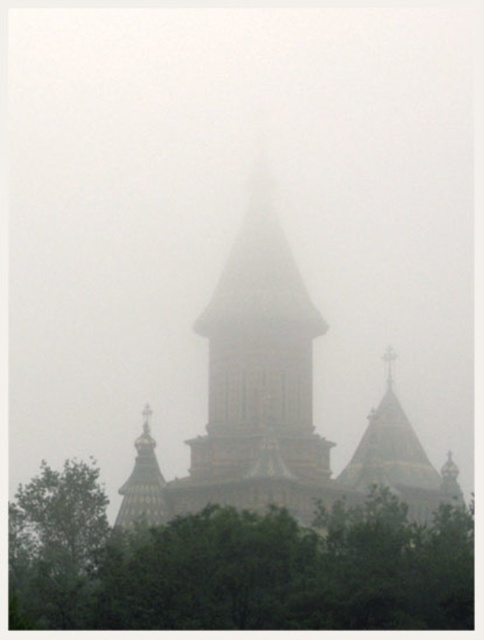
Question: Which object is positioned closest to the green leafy tree at lower center?

Choices:
 (A) golden mosaic temple at center
 (B) brown stone bell tower at center

Answer: (A)

Question: Which point is farther to the camera?

Choices:
 (A) (376, 616)
 (B) (252, 202)
 (C) (74, 561)
 (D) (226, 385)

Answer: (B)

Question: Is brown stone bell tower at center thinner than green leafy tree at left?

Choices:
 (A) no
 (B) yes

Answer: (A)

Question: Does green leafy tree at lower center have a larger size compared to golden mosaic temple at center?

Choices:
 (A) no
 (B) yes

Answer: (A)

Question: Considering the real-world distances, which object is closest to the golden mosaic temple at center?

Choices:
 (A) brown stone bell tower at center
 (B) green leafy tree at left
 (C) green leafy tree at lower center

Answer: (A)

Question: Can you confirm if green leafy tree at lower center is bigger than golden mosaic temple at center?

Choices:
 (A) no
 (B) yes

Answer: (A)